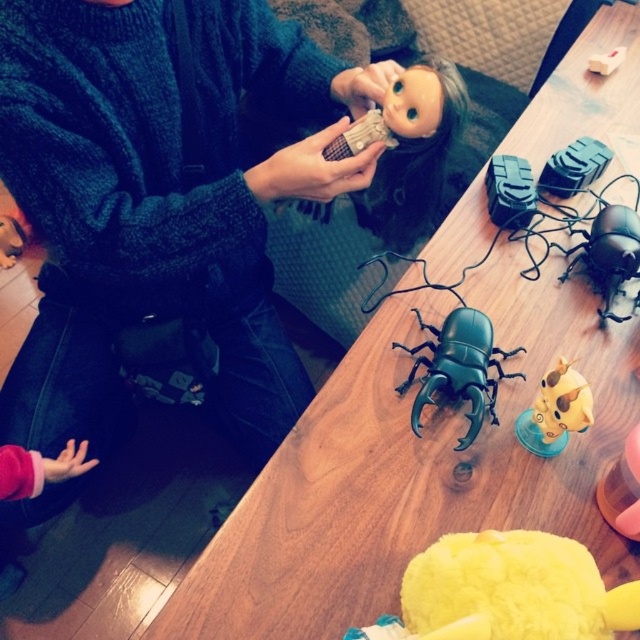
Who is positioned more to the right, green matte beetle at center or yellow matte toy at center-right?

yellow matte toy at center-right

Which is more to the left, green matte beetle at center or yellow matte toy at center-right?

Positioned to the left is green matte beetle at center.

The height and width of the screenshot is (640, 640). Describe the element at coordinates (458, 368) in the screenshot. I see `green matte beetle at center` at that location.

You are a GUI agent. You are given a task and a screenshot of the screen. Output one action in this format:
    pyautogui.click(x=<x>, y=<y>)
    Task: Click on the green matte beetle at center
    The image size is (640, 640).
    Given the screenshot: What is the action you would take?
    pyautogui.click(x=458, y=368)

Describe the element at coordinates (458, 368) in the screenshot. I see `green matte beetle at center` at that location.

You are a GUI agent. You are given a task and a screenshot of the screen. Output one action in this format:
    pyautogui.click(x=<x>, y=<y>)
    Task: Click on the green matte beetle at center
    Image resolution: width=640 pixels, height=640 pixels.
    Given the screenshot: What is the action you would take?
    pyautogui.click(x=458, y=368)

Looking at this image, does black matte beetle at right have a smaller size compared to yellow matte toy at center-right?

No, black matte beetle at right is not smaller than yellow matte toy at center-right.

Between point (630, 221) and point (516, 433), which one is positioned in front?

Point (516, 433)

The image size is (640, 640). In order to click on black matte beetle at right in this screenshot , I will do `click(609, 252)`.